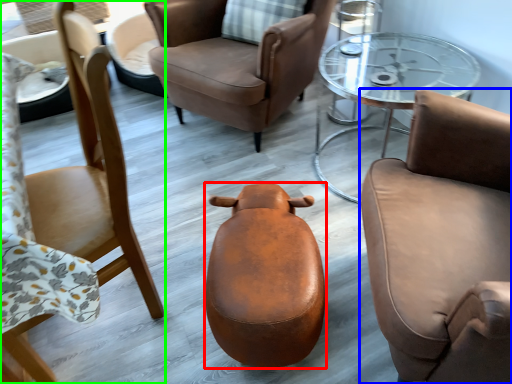
Question: Based on their relative distances, which object is farther from stool (highlighted by a red box)? Choose from chair (highlighted by a blue box) and chair (highlighted by a green box).

Choices:
 (A) chair
 (B) chair

Answer: (B)